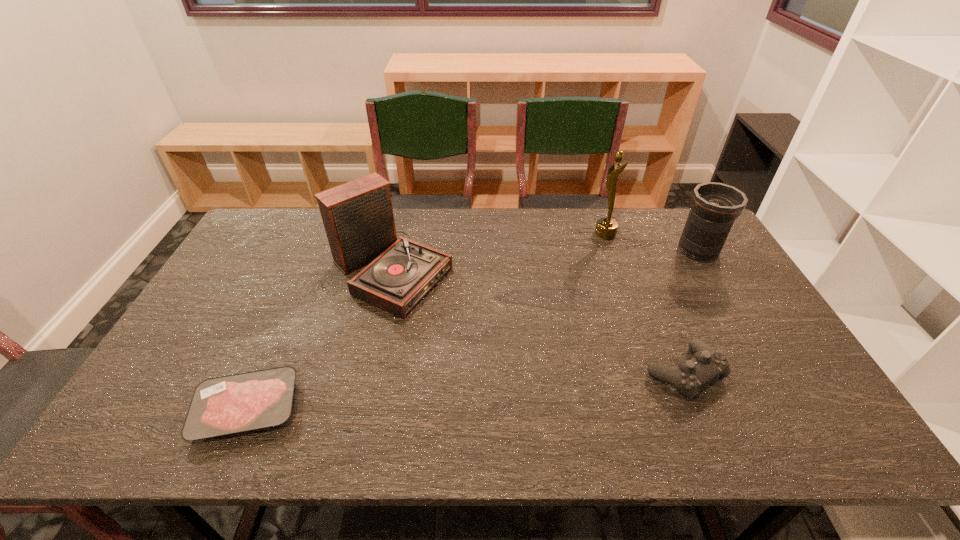
In order to click on vacant space in between the control and the shortest object in this screenshot , I will do `click(466, 391)`.

The height and width of the screenshot is (540, 960). What are the coordinates of `vacant space that's between the steak and the rightmost object` in the screenshot? It's located at tap(472, 329).

Locate an element on the screen. This screenshot has width=960, height=540. empty location between the control and the third shortest object is located at coordinates (691, 312).

The height and width of the screenshot is (540, 960). I want to click on vacant region between the phonograph record and the third tallest object, so pyautogui.click(x=544, y=261).

At what (x,y) coordinates should I click in order to perform the action: click on vacant area between the control and the rightmost object. Please return your answer as a coordinate pair (x, y). Looking at the image, I should click on (691, 312).

Locate an element on the screen. The image size is (960, 540). object that stands as the closest to the telephoto lens is located at coordinates (606, 228).

Locate which object is the second closest to the award. Please provide its 2D coordinates. Your answer should be formatted as a tuple, i.e. [(x, y)], where the tuple contains the x and y coordinates of a point satisfying the conditions above.

[(707, 365)]

Identify the location of vacant region that satisfies the following two spatial constraints: 1. on the front side of the fourth shortest object; 2. on the left side of the control. (368, 373).

Find the location of a particular element. Image resolution: width=960 pixels, height=540 pixels. free space in the image that satisfies the following two spatial constraints: 1. on the back side of the second shortest object; 2. on the left side of the steak is located at coordinates (262, 373).

Where is `vacant region that satisfies the following two spatial constraints: 1. on the front-facing side of the award; 2. on the left side of the fourth tallest object`? This screenshot has height=540, width=960. vacant region that satisfies the following two spatial constraints: 1. on the front-facing side of the award; 2. on the left side of the fourth tallest object is located at coordinates (655, 373).